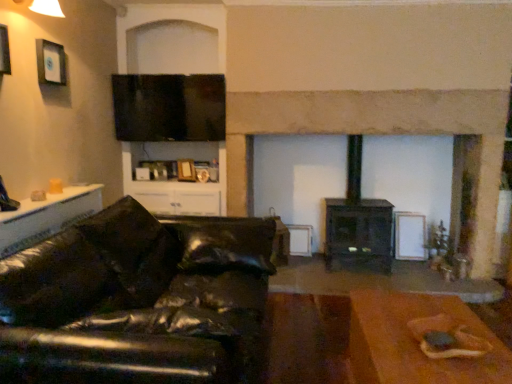
Find the location of a particular element. white glossy table at left, positioned as the 2th table in bottom-to-top order is located at coordinates (47, 217).

Identify the location of flat matte screen at upper center. (169, 107).

How much space does brown wooden table at lower right, which is the first table from bottom to top, occupy horizontally?

23.72 inches.

This screenshot has height=384, width=512. Find the location of `white glossy table at left, the first table from the left`. white glossy table at left, the first table from the left is located at coordinates [47, 217].

Does point (144, 123) come in front of point (26, 292)?

No.

Which object is thinner, flat matte screen at upper center or black leather couch at left?

flat matte screen at upper center is thinner.

From a real-world perspective, is flat matte screen at upper center physically above black leather couch at left?

Yes, from a real-world perspective, flat matte screen at upper center is above black leather couch at left.

Does brown wooden table at lower right, arranged as the first table when viewed from the right, have a greater height compared to flat matte screen at upper center?

In fact, brown wooden table at lower right, arranged as the first table when viewed from the right, may be shorter than flat matte screen at upper center.

In the scene shown: Based on their positions, is brown wooden table at lower right, which is the first table from bottom to top, located to the left or right of flat matte screen at upper center?

brown wooden table at lower right, which is the first table from bottom to top, is to the right of flat matte screen at upper center.

From a real-world perspective, is brown wooden table at lower right, which is the first table from bottom to top, positioned above or below flat matte screen at upper center?

brown wooden table at lower right, which is the first table from bottom to top, is situated lower than flat matte screen at upper center in the real world.

Is white glossy table at left, the first table from the left, facing towards black matte wood burning stove at center?

No.

The height and width of the screenshot is (384, 512). I want to click on table that is the 1st one when counting forward from the black matte wood burning stove at center, so click(47, 217).

From a real-world perspective, is white glossy table at left, which is the second table from right to left, physically located above or below black matte wood burning stove at center?

In terms of real-world spatial position, white glossy table at left, which is the second table from right to left, is above black matte wood burning stove at center.

Between white glossy table at left, positioned as the 2th table in bottom-to-top order, and black matte wood burning stove at center, which one appears on the right side from the viewer's perspective?

black matte wood burning stove at center is more to the right.

From a real-world perspective, relative to brown wooden table at lower right, which is the first table from bottom to top, is white glossy table at left, which is the second table from right to left, vertically above or below?

In terms of real-world spatial position, white glossy table at left, which is the second table from right to left, is above brown wooden table at lower right, which is the first table from bottom to top.

Locate an element on the screen. The width and height of the screenshot is (512, 384). table below the white glossy table at left, the first table from the left (from a real-world perspective) is located at coordinates (421, 341).

Considering the positions of objects white glossy table at left, the first table from the left, and brown wooden table at lower right, the second table viewed from the left, in the image provided, who is in front, white glossy table at left, the first table from the left, or brown wooden table at lower right, the second table viewed from the left,?

brown wooden table at lower right, the second table viewed from the left, is closer to the camera.

Is white glossy table at left, the first table from the left, not close to brown wooden table at lower right, which is the first table from bottom to top?

Indeed, white glossy table at left, the first table from the left, is not near brown wooden table at lower right, which is the first table from bottom to top.

Can you confirm if flat matte screen at upper center is positioned to the right of brown wooden table at lower right, arranged as the first table when viewed from the right?

No, flat matte screen at upper center is not to the right of brown wooden table at lower right, arranged as the first table when viewed from the right.

Based on the photo, who is bigger, flat matte screen at upper center or brown wooden table at lower right, the second table viewed from the left?

brown wooden table at lower right, the second table viewed from the left.

Between flat matte screen at upper center and brown wooden table at lower right, the second table viewed from the left, which one has more height?

flat matte screen at upper center is taller.

Between point (129, 114) and point (439, 383), which one is positioned in front?

Positioned in front is point (439, 383).

From a real-world perspective, which object stands above the other?

flat matte screen at upper center is physically above.

Does black matte wood burning stove at center touch flat matte screen at upper center?

No, black matte wood burning stove at center is not beside flat matte screen at upper center.

Is flat matte screen at upper center completely or partially inside black matte wood burning stove at center?

No, flat matte screen at upper center is located outside of black matte wood burning stove at center.

Is brown wooden table at lower right, arranged as the first table when viewed from the right, thinner than black leather couch at left?

Yes, brown wooden table at lower right, arranged as the first table when viewed from the right, is thinner than black leather couch at left.

Is point (449, 354) closer or farther from the camera than point (46, 276)?

Clearly, point (449, 354) is more distant from the camera than point (46, 276).

From a real-world perspective, which is physically below, brown wooden table at lower right, arranged as the first table when viewed from the right, or black leather couch at left?

brown wooden table at lower right, arranged as the first table when viewed from the right.

Is brown wooden table at lower right, the second table viewed from the left, shorter than black leather couch at left?

Yes.

The height and width of the screenshot is (384, 512). I want to click on studio couch lying below the flat matte screen at upper center (from the image's perspective), so click(136, 300).

You are a GUI agent. You are given a task and a screenshot of the screen. Output one action in this format:
    pyautogui.click(x=<x>, y=<y>)
    Task: Click on the window screen above the brown wooden table at lower right, the second table viewed from the left (from the image's perspective)
    
    Given the screenshot: What is the action you would take?
    pyautogui.click(x=169, y=107)

When comparing their distances from white glossy table at left, the first table when ordered from top to bottom, does brown wooden table at lower right, which is the first table from bottom to top, or black matte wood burning stove at center seem further?

Based on the image, black matte wood burning stove at center appears to be further to white glossy table at left, the first table when ordered from top to bottom.

From the image, which object appears to be farther from black matte wood burning stove at center, flat matte screen at upper center or black leather couch at left?

black leather couch at left is further to black matte wood burning stove at center.

Which object lies further to the anchor point black leather couch at left, black matte wood burning stove at center or brown wooden table at lower right, arranged as the first table when viewed from the right?

black matte wood burning stove at center is further to black leather couch at left.

From the image, which object appears to be nearer to black matte wood burning stove at center, white glossy table at left, the first table from the left, or flat matte screen at upper center?

flat matte screen at upper center.

Looking at the image, which one is located further to white glossy table at left, which is the second table from right to left, black leather couch at left or brown wooden table at lower right, which is the first table from bottom to top?

Among the two, brown wooden table at lower right, which is the first table from bottom to top, is located further to white glossy table at left, which is the second table from right to left.

Based on their spatial positions, is flat matte screen at upper center or black leather couch at left further from brown wooden table at lower right, arranged as the first table when viewed from the right?

flat matte screen at upper center lies further to brown wooden table at lower right, arranged as the first table when viewed from the right, than the other object.

When comparing their distances from flat matte screen at upper center, does brown wooden table at lower right, arranged as the first table when viewed from the right, or white glossy table at left, the first table from the left, seem closer?

white glossy table at left, the first table from the left, lies closer to flat matte screen at upper center than the other object.

Considering their positions, is brown wooden table at lower right, marked as the second table in a top-to-bottom arrangement, positioned closer to black matte wood burning stove at center than flat matte screen at upper center?

flat matte screen at upper center lies closer to black matte wood burning stove at center than the other object.

This screenshot has width=512, height=384. In order to click on studio couch between white glossy table at left, the first table when ordered from top to bottom, and brown wooden table at lower right, which is the first table from bottom to top in this screenshot , I will do `click(136, 300)`.

At what (x,y) coordinates should I click in order to perform the action: click on table between white glossy table at left, the first table from the left, and black matte wood burning stove at center from left to right. Please return your answer as a coordinate pair (x, y). Looking at the image, I should click on (421, 341).

This screenshot has height=384, width=512. In order to click on wood burning stove positioned between brown wooden table at lower right, which is the first table from bottom to top, and flat matte screen at upper center from near to far in this screenshot , I will do `click(358, 223)`.

What are the coordinates of `table positioned between brown wooden table at lower right, which is the first table from bottom to top, and flat matte screen at upper center from near to far` in the screenshot? It's located at (47, 217).